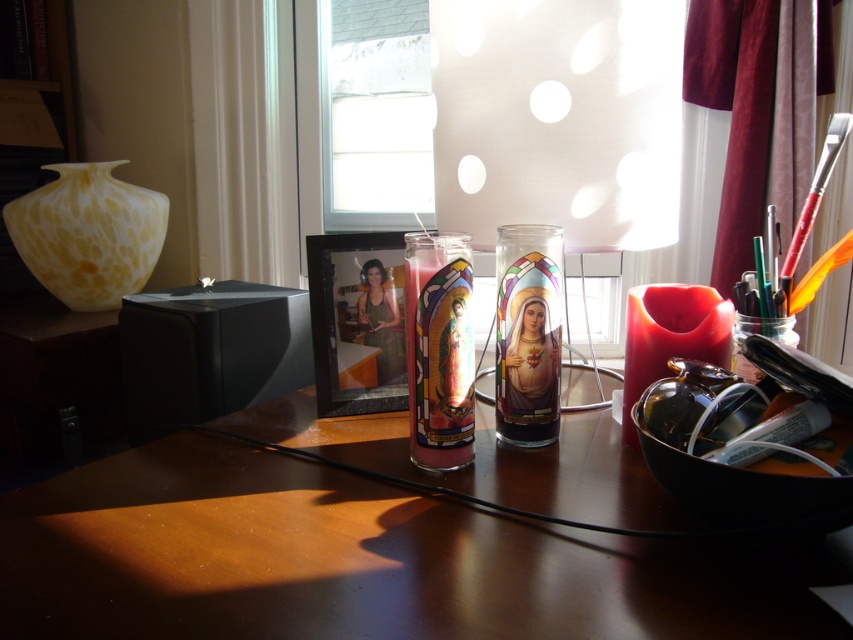
Can you confirm if matte yellow glass vase at left is thinner than translucent plastic jar at right?

No, matte yellow glass vase at left is not thinner than translucent plastic jar at right.

Can you confirm if matte yellow glass vase at left is taller than translucent plastic jar at right?

Correct, matte yellow glass vase at left is much taller as translucent plastic jar at right.

Locate an element on the screen. matte yellow glass vase at left is located at coordinates (88, 234).

Is brown wooden table at center below matte white lampshade at center?

Yes, brown wooden table at center is below matte white lampshade at center.

What are the coordinates of `brown wooden table at center` in the screenshot? It's located at (363, 561).

Can you confirm if transparent glass window at upper center is smaller than matte yellow glass vase at left?

Incorrect, transparent glass window at upper center is not smaller in size than matte yellow glass vase at left.

Looking at this image, is transparent glass window at upper center taller than matte yellow glass vase at left?

Indeed, transparent glass window at upper center has a greater height compared to matte yellow glass vase at left.

Who is more forward, (357,58) or (22,202)?

Positioned in front is point (22,202).

Where is `transparent glass window at upper center`? transparent glass window at upper center is located at coordinates 375,113.